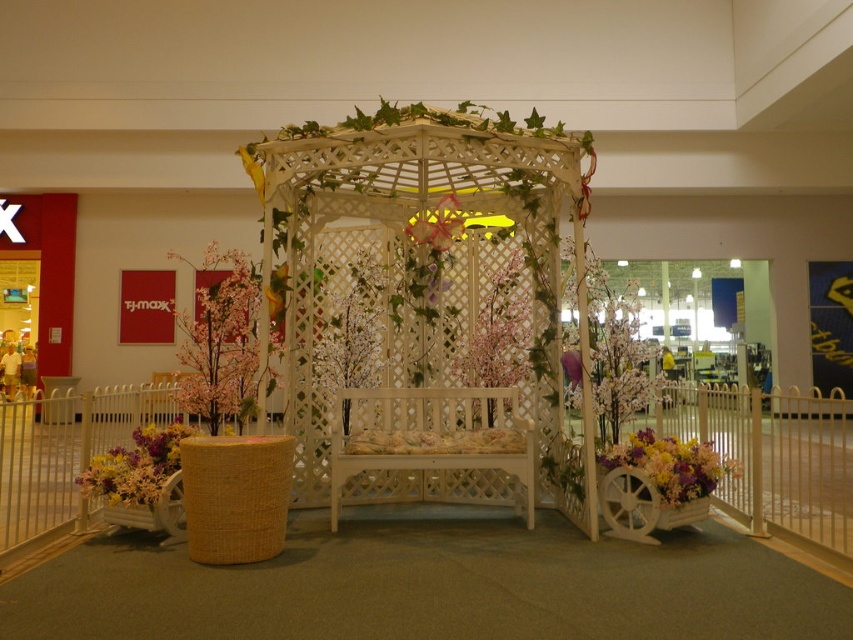
Question: Among these points, which one is farthest from the camera?

Choices:
 (A) (122, 458)
 (B) (200, 349)

Answer: (B)

Question: Can you confirm if pink artificial tree at left is bigger than vibrant floral bouquet at lower left?

Choices:
 (A) yes
 (B) no

Answer: (B)

Question: Among these objects, which one is farthest from the camera?

Choices:
 (A) white lattice gazebo at center
 (B) vibrant floral bouquet at lower left
 (C) floral bouquet at lower right

Answer: (A)

Question: Which is farther from the white lattice gazebo at center?

Choices:
 (A) pink artificial tree at left
 (B) floral bouquet at lower right

Answer: (B)

Question: Is pink artificial tree at left below vibrant floral bouquet at lower left?

Choices:
 (A) yes
 (B) no

Answer: (B)

Question: Is the position of pink artificial tree at left less distant than that of vibrant floral bouquet at lower left?

Choices:
 (A) no
 (B) yes

Answer: (A)